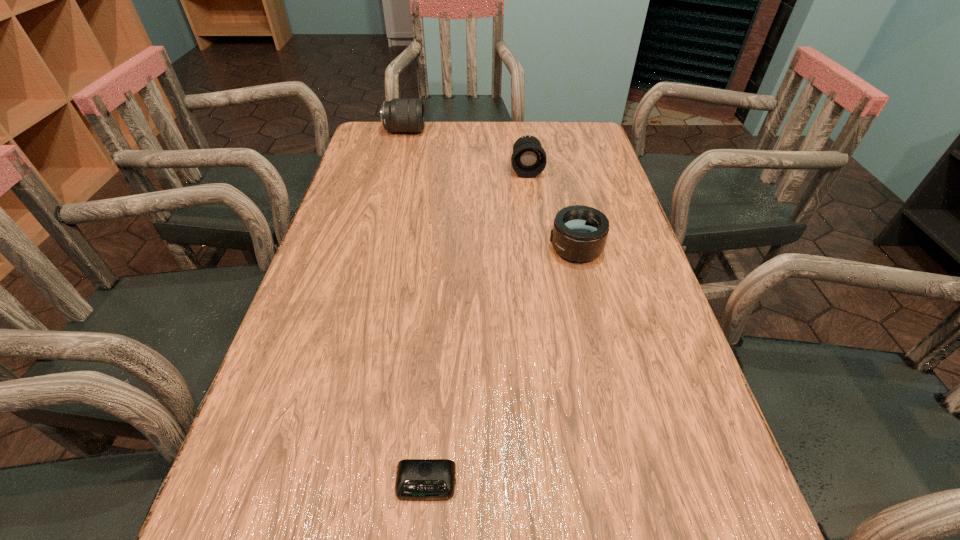
Find the location of `free space located 0.080m on the side of the second nearest object with brand markings and control switches`. free space located 0.080m on the side of the second nearest object with brand markings and control switches is located at coordinates (516, 248).

Find the location of a particular element. The height and width of the screenshot is (540, 960). free location located on the side of the second nearest object with brand markings and control switches is located at coordinates (507, 248).

This screenshot has height=540, width=960. I want to click on object that is at the far edge, so [x=400, y=114].

Where is `object located at the left edge`? The width and height of the screenshot is (960, 540). object located at the left edge is located at coordinates (400, 114).

Identify the location of object that is at the right edge. The height and width of the screenshot is (540, 960). (579, 233).

The height and width of the screenshot is (540, 960). What are the coordinates of `object that is at the far left corner` in the screenshot? It's located at tap(400, 114).

Identify the location of vacant area at the left edge. (349, 244).

In the image, there is a desktop. What are the coordinates of `vacant space at the right edge` in the screenshot? It's located at (588, 263).

This screenshot has width=960, height=540. In the image, there is a desktop. In order to click on free region at the far left corner in this screenshot , I will do `click(381, 152)`.

Identify the location of vacant point at the far right corner. This screenshot has width=960, height=540. 567,134.